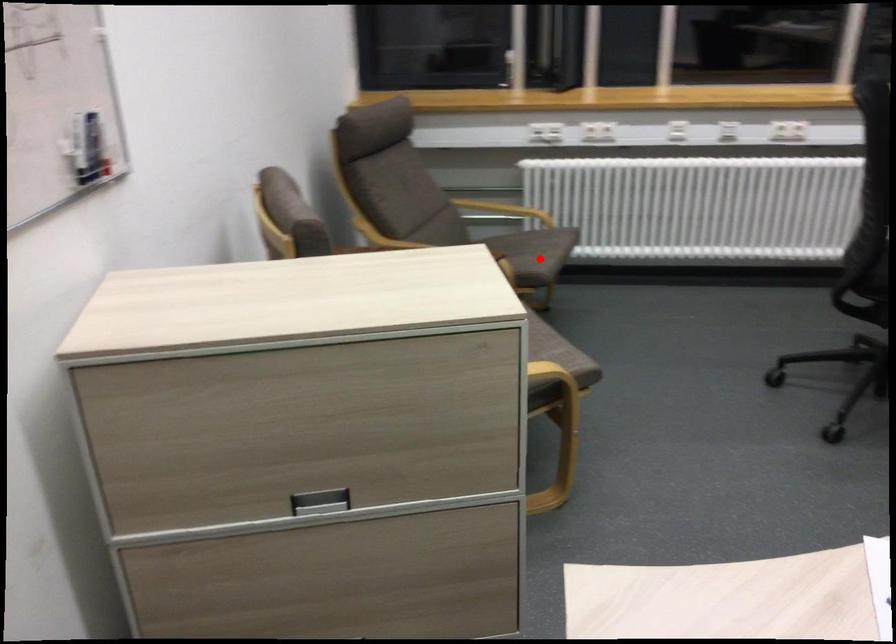
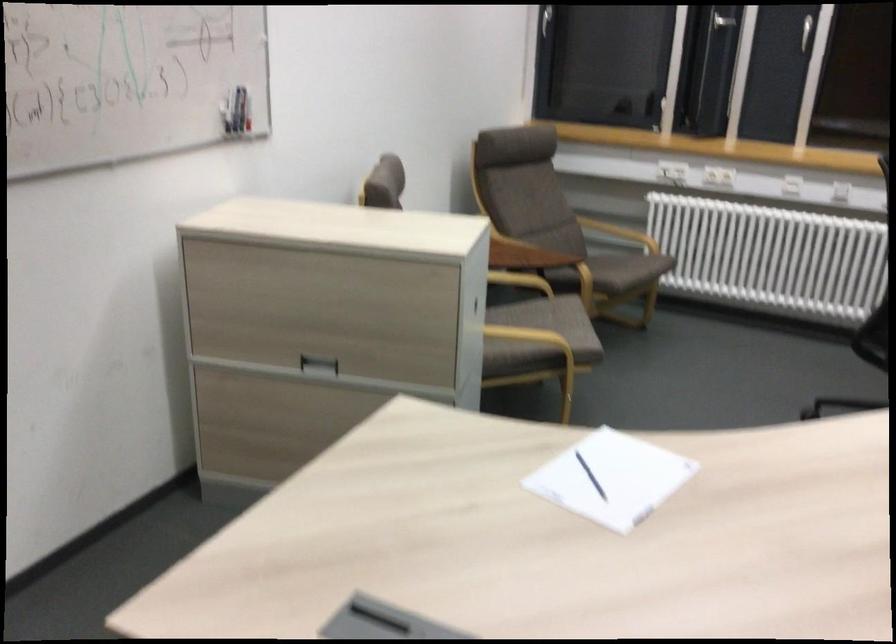
Question: I am providing you with two images of the same scene from different viewpoints. A red point is marked on the first image. Can you still see the location of the red point in image 2?

Choices:
 (A) Yes
 (B) No

Answer: (A)